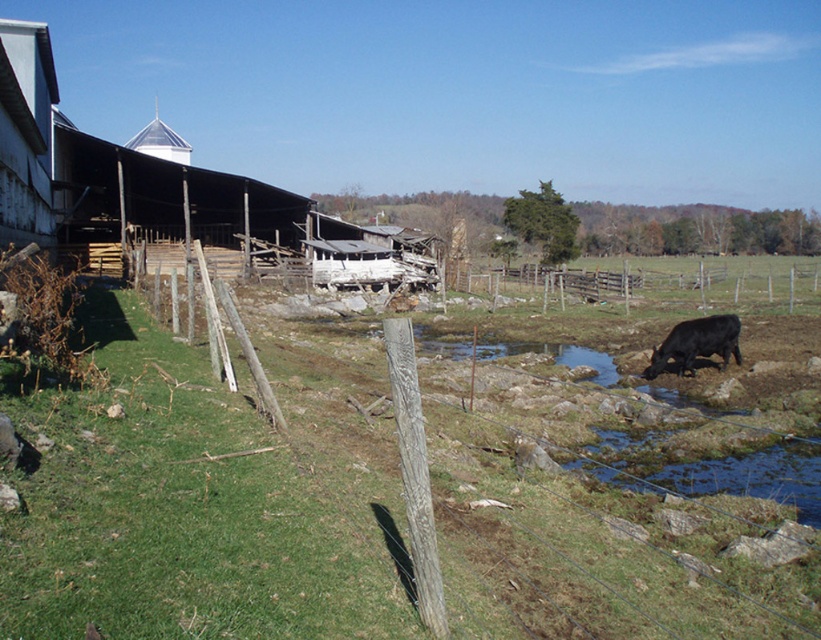
Question: Among these points, which one is nearest to the camera?

Choices:
 (A) (643, 376)
 (B) (459, 291)

Answer: (A)

Question: Can you confirm if wooden fence at center-right is wider than black glossy cow at lower right?

Choices:
 (A) yes
 (B) no

Answer: (A)

Question: Does wooden fence at center-right appear on the left side of black glossy cow at lower right?

Choices:
 (A) no
 (B) yes

Answer: (A)

Question: Is wooden fence at center-right further to the viewer compared to black glossy cow at lower right?

Choices:
 (A) yes
 (B) no

Answer: (A)